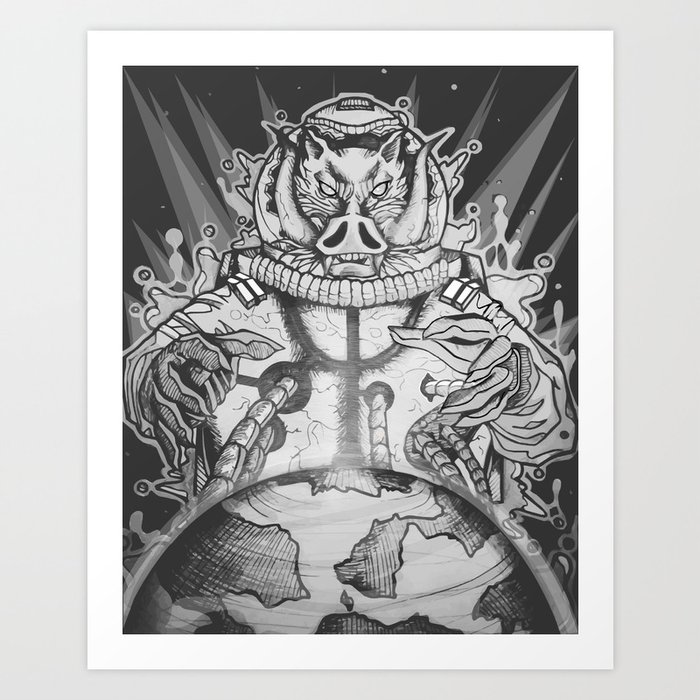
Find the location of `poster`. poster is located at coordinates (336, 525).